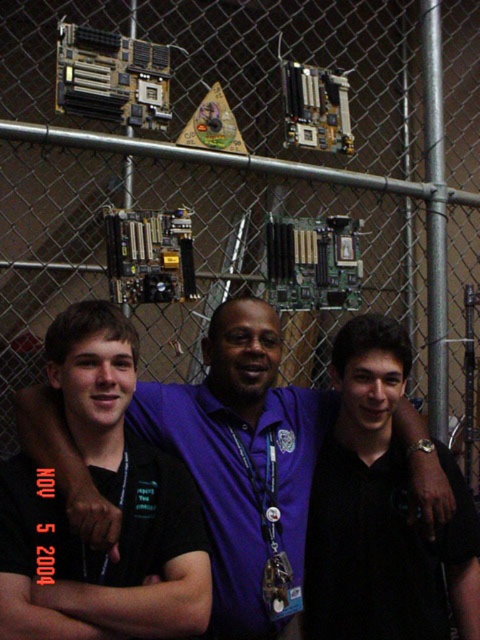
From the picture: You are standing in front of a group of people posing near a chain link fence with computer parts. There is a specific point marked at coordinates point (x=251, y=360). If you want to place a 5 foot long banner between you and that point, will it fit without overlapping the people?

The distance between you and point (x=251, y=360) is 5.53 feet. Since the banner is 5 feet long, it will fit without overlapping the people as there is enough space.

You are a photographer taking a group photo of the purple shirt at center and the black matte shirt at center. Since you want to ensure both are clearly visible, which subject should you focus on first considering their sizes?

The purple shirt at center is bigger than the black matte shirt at center, so you should focus on the purple shirt at center first to ensure it is in clear focus before adjusting for the smaller one.

You are a photographer trying to capture a group photo of the purple shirt at center and the black matte shirt at center. Since you want to ensure both subjects are clearly visible, which subject should you focus on to account for their size difference?

The purple shirt at center is wider than the black matte shirt at center, so focusing on the purple shirt at center would ensure both subjects are clearly visible due to its larger size.